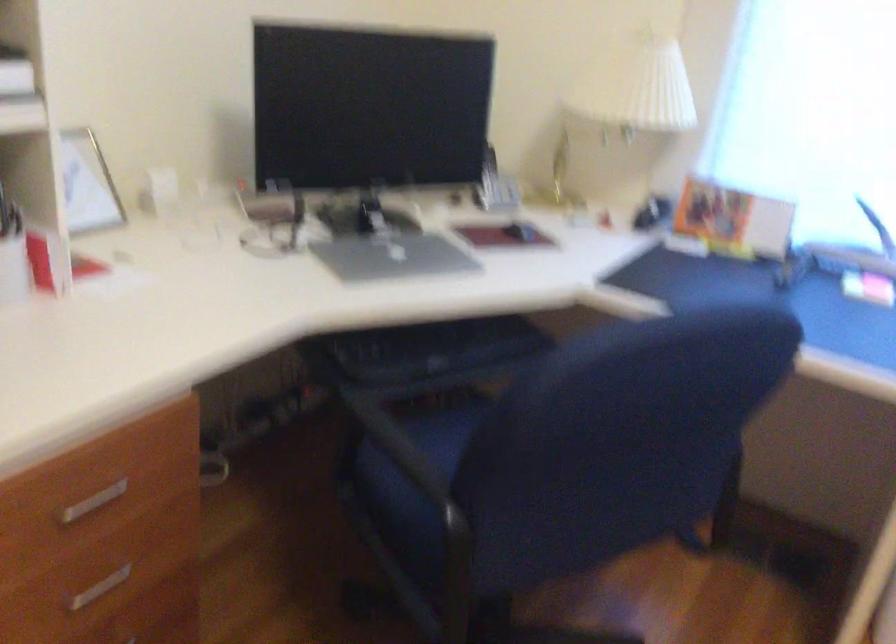
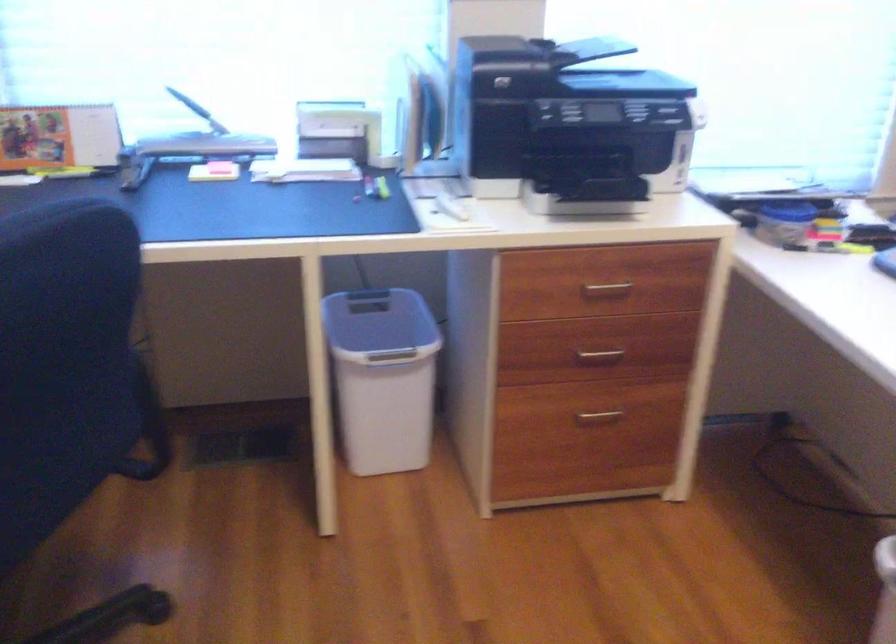
Question: The first image is from the beginning of the video and the second image is from the end. How did the camera likely rotate when shooting the video?

Choices:
 (A) Left
 (B) Right
 (C) Up
 (D) Down

Answer: (B)